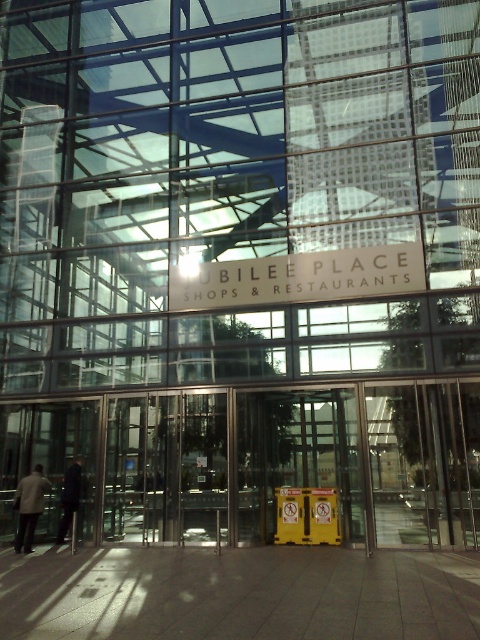
Question: Among these points, which one is nearest to the camera?

Choices:
 (A) (66, 477)
 (B) (49, 483)

Answer: (A)

Question: Does light beige jacket at lower left appear on the right side of dark blue suit at center?

Choices:
 (A) no
 (B) yes

Answer: (A)

Question: Which object appears farthest from the camera in this image?

Choices:
 (A) dark blue suit at center
 (B) light beige jacket at lower left
 (C) white matte sign at center

Answer: (A)

Question: Which object is the closest to the white matte sign at center?

Choices:
 (A) light beige jacket at lower left
 (B) dark blue suit at center

Answer: (B)

Question: Does light beige jacket at lower left have a greater width compared to dark blue suit at center?

Choices:
 (A) no
 (B) yes

Answer: (B)

Question: Is the position of white matte sign at center less distant than that of light beige jacket at lower left?

Choices:
 (A) no
 (B) yes

Answer: (B)